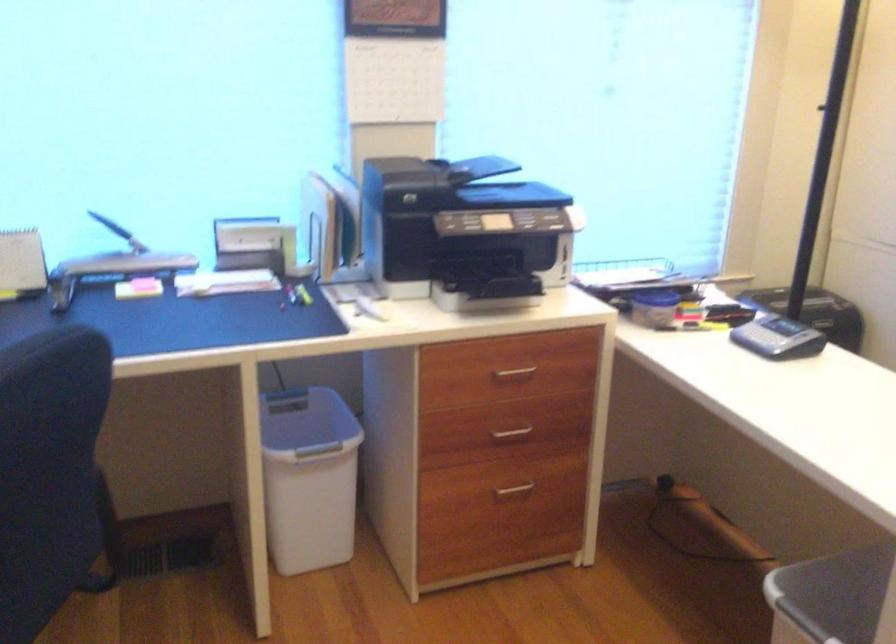
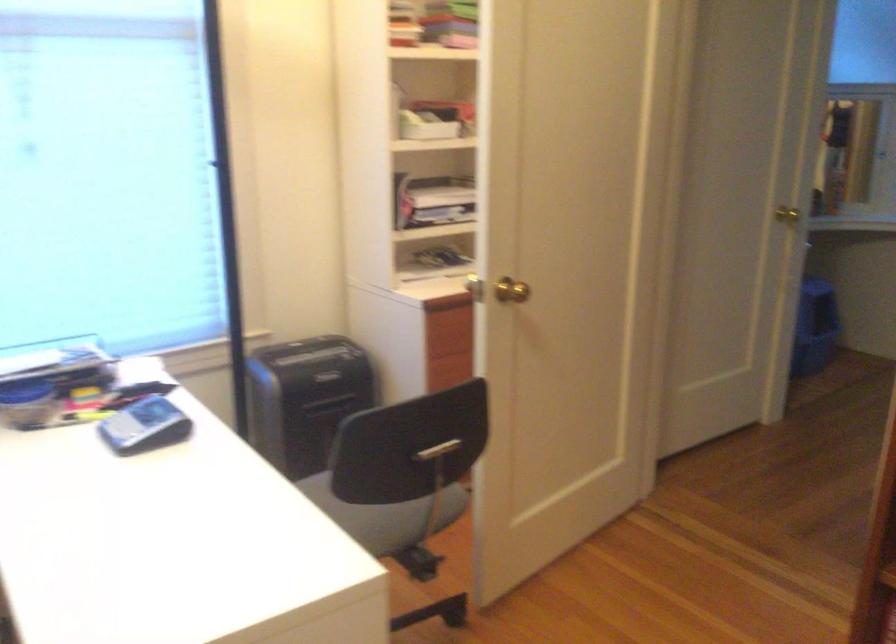
Question: Which direction would the cameraman need to move to produce the second image? Reply with the corresponding letter.

Choices:
 (A) Left
 (B) Right
 (C) Forward
 (D) Backward

Answer: (B)